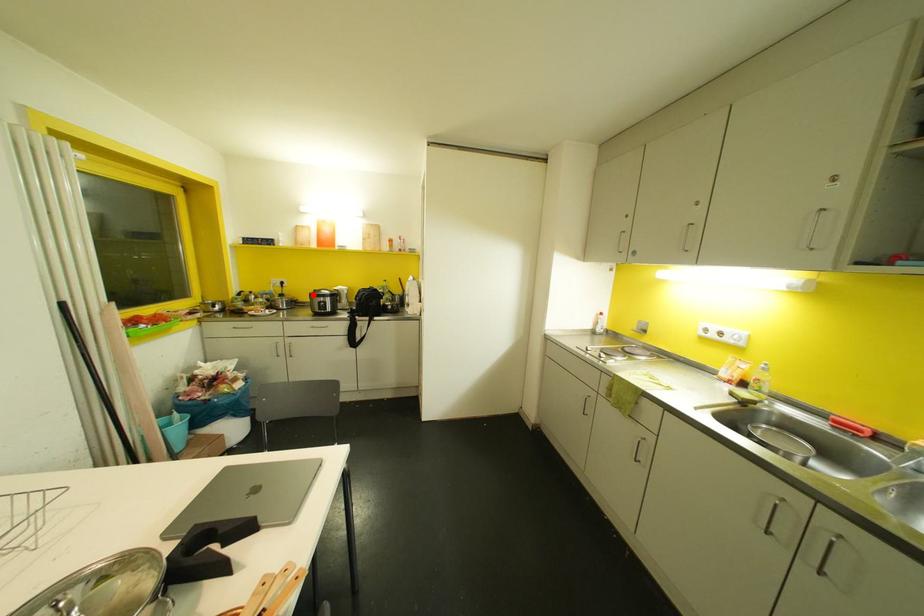
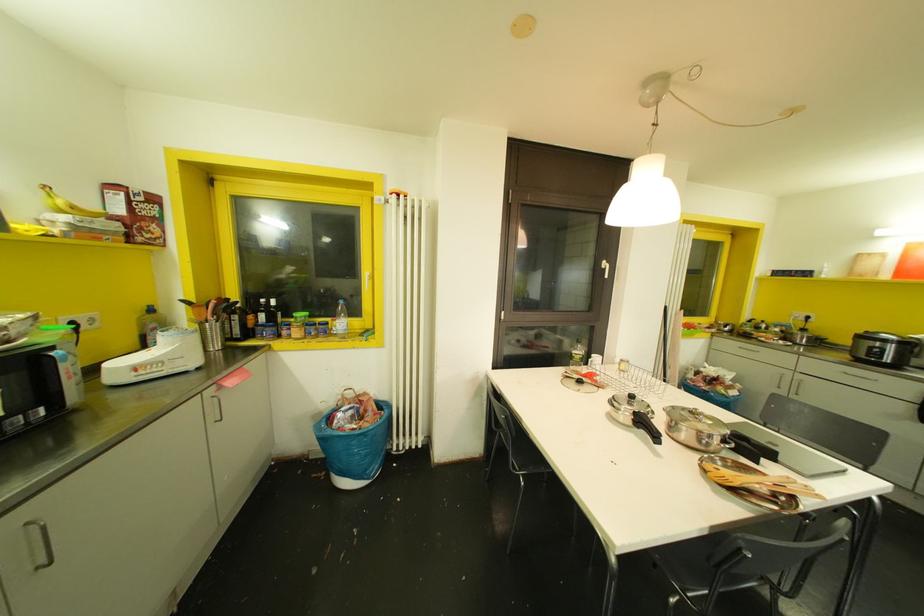
Question: I am providing you with two images of the same scene from different viewpoints. In image1, a red point is highlighted. Considering the same 3D point in image2, which of the following is correct?

Choices:
 (A) It is closer
 (B) It is farther

Answer: (B)